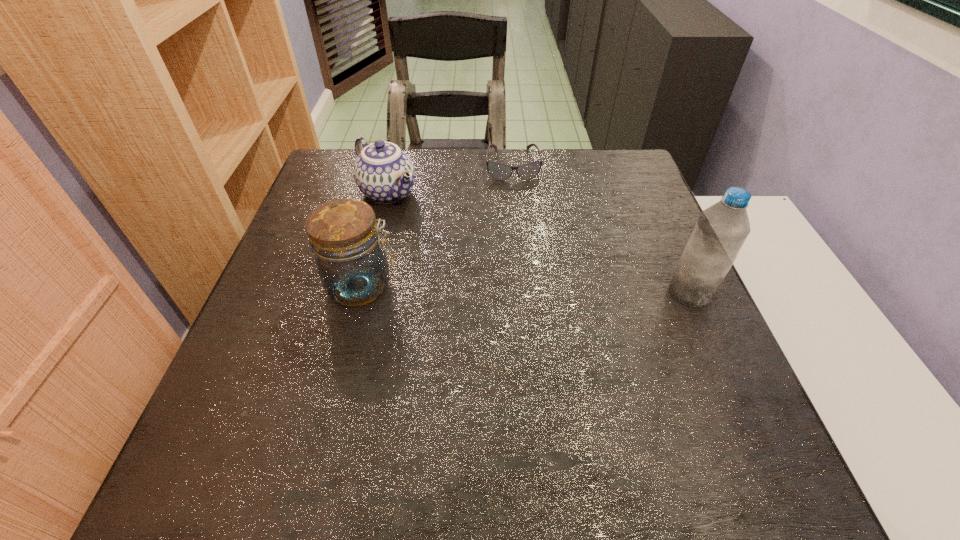
Find the location of a particular element. The height and width of the screenshot is (540, 960). blank space at the far edge of the desktop is located at coordinates (482, 188).

Where is `free space at the near edge`? The image size is (960, 540). free space at the near edge is located at coordinates (380, 393).

You are a GUI agent. You are given a task and a screenshot of the screen. Output one action in this format:
    pyautogui.click(x=<x>, y=<y>)
    Task: Click on the free space at the left edge of the desktop
    
    Given the screenshot: What is the action you would take?
    (x=286, y=299)

The width and height of the screenshot is (960, 540). In the image, there is a desktop. In order to click on vacant area at the right edge in this screenshot , I will do `click(615, 288)`.

In the image, there is a desktop. Identify the location of vacant space at the near left corner. (277, 422).

Locate an element on the screen. vacant space in between the third shortest object and the rightmost object is located at coordinates (526, 289).

In order to click on vacant area between the third tallest object and the rightmost object in this screenshot , I will do click(539, 242).

At what (x,y) coordinates should I click in order to perform the action: click on vacant area that lies between the shortest object and the tallest object. Please return your answer as a coordinate pair (x, y). This screenshot has height=540, width=960. Looking at the image, I should click on (601, 229).

Find the location of `vacant space that's between the rightmost object and the chinaware`. vacant space that's between the rightmost object and the chinaware is located at coordinates (539, 242).

Identify the location of vacant space that's between the second tallest object and the tallest object. This screenshot has width=960, height=540. (526, 289).